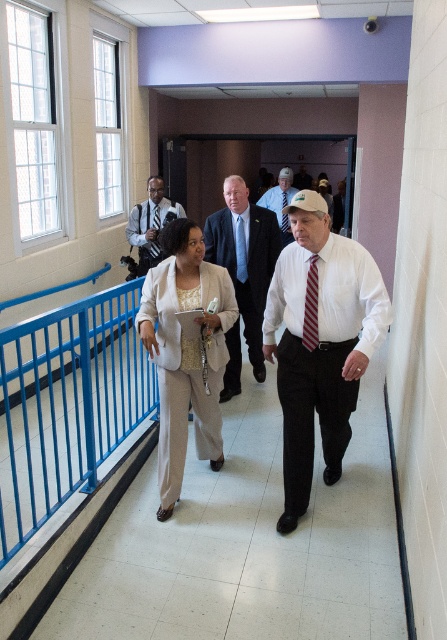
You are standing at point (275,188) in the corridor and want to walk to the exit located at point (38,456). Is the exit directly in front of you?

Yes, the exit at point (38,456) is directly in front of you because point (38,456) is in front of point (275,188).

You are standing in the corridor and want to reach the blue metallic handrail at left. Based on your current position, which direction should you move to reach it?

The blue metallic handrail at left is located at point coordinates, so you should move towards the left side of the corridor to reach it.

You are standing in the corridor and want to reach the blue metallic handrail at left from the beige fabric suit at center. Which direction should you move?

To reach the blue metallic handrail at left from the beige fabric suit at center, you should move to the left since the blue metallic handrail at left is located to the left of the beige fabric suit at center.